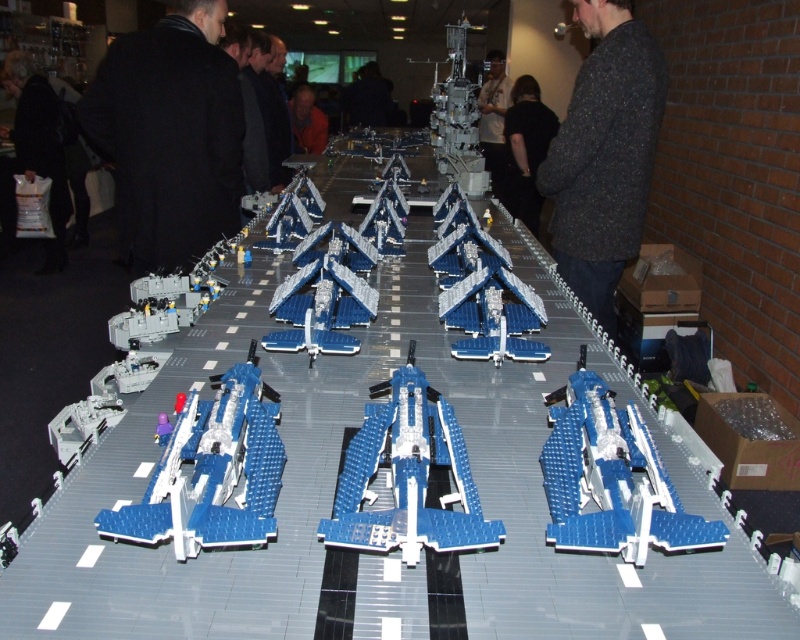
Between black coat at left and black fabric at center, which one has less height?

Standing shorter between the two is black coat at left.

Is black coat at left positioned behind black fabric at center?

No, it is in front of black fabric at center.

Does point (226, 54) come behind point (533, 102)?

No, (226, 54) is in front of (533, 102).

Image resolution: width=800 pixels, height=640 pixels. Find the location of `black coat at left`. black coat at left is located at coordinates (170, 134).

Which is behind, point (537, 152) or point (496, 76)?

The point (496, 76) is more distant.

Who is lower down, black fabric at center or dark gray sweater at center?

black fabric at center is lower down.

Between point (524, 83) and point (478, 134), which one is positioned in front?

Positioned in front is point (478, 134).

This screenshot has width=800, height=640. Identify the location of black fabric at center. (525, 148).

From the picture: Does speckled dark gray sweater at upper center appear under dark gray sweater at center?

Indeed, speckled dark gray sweater at upper center is positioned under dark gray sweater at center.

Can you confirm if speckled dark gray sweater at upper center is positioned to the left of dark gray sweater at center?

Indeed, speckled dark gray sweater at upper center is positioned on the left side of dark gray sweater at center.

Which is behind, point (629, 140) or point (498, 138)?

The point (498, 138) is behind.

What are the coordinates of `speckled dark gray sweater at upper center` in the screenshot? It's located at (604, 154).